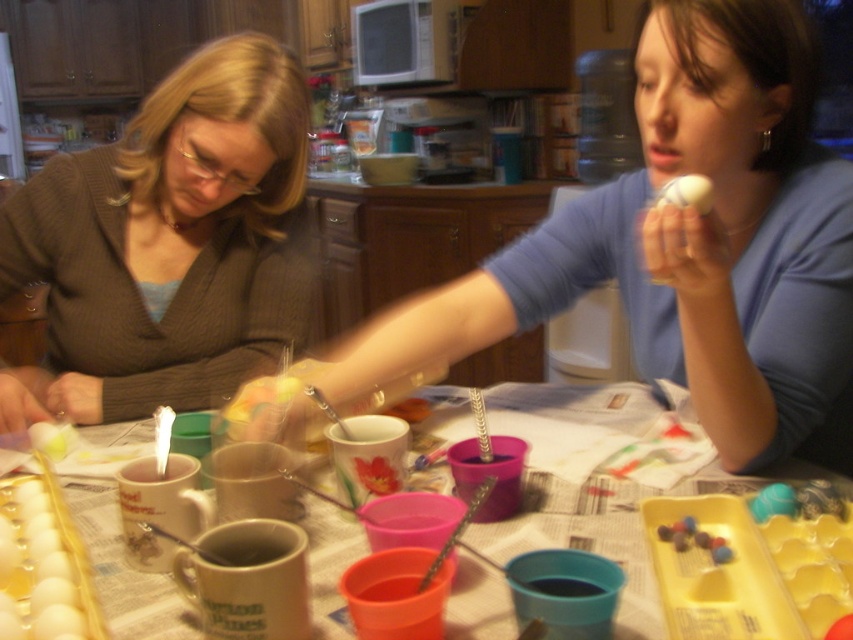
You are a delivery person who needs to place a small package on the table between the matte blue shirt at center and the matte yellow egg at upper center. Can you fit the package there if it measures 6 inches in length?

The distance between the matte blue shirt at center and the matte yellow egg at upper center is 7.53 inches. Since the package is 6 inches long, there is enough space to place it between them.

You are a guest at this kitchen table and want to reach for the matte yellow egg at upper center without touching the matte blue shirt at center. Is this possible?

The matte blue shirt at center is positioned under the matte yellow egg at upper center, so you can reach the matte yellow egg at upper center without touching the matte blue shirt at center by grabbing it from above.